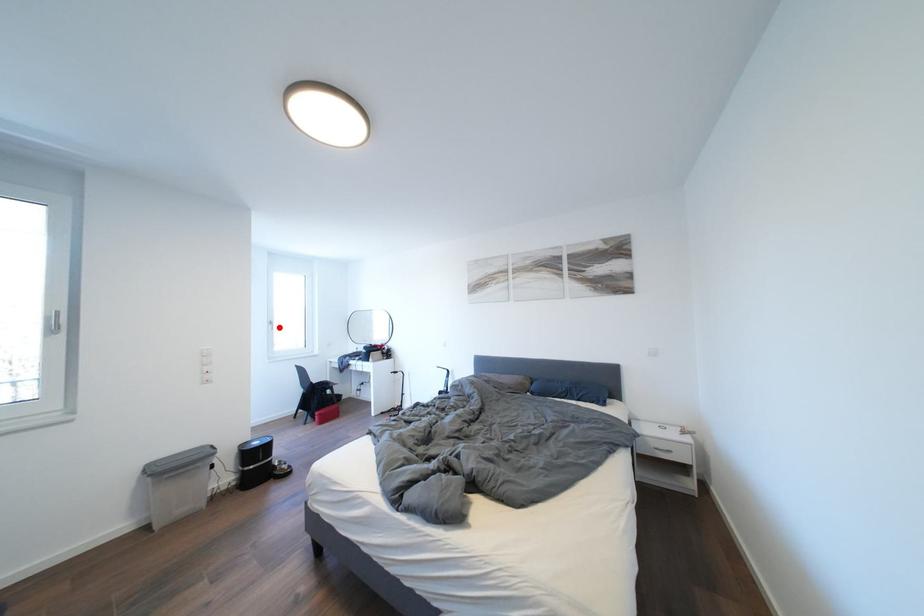
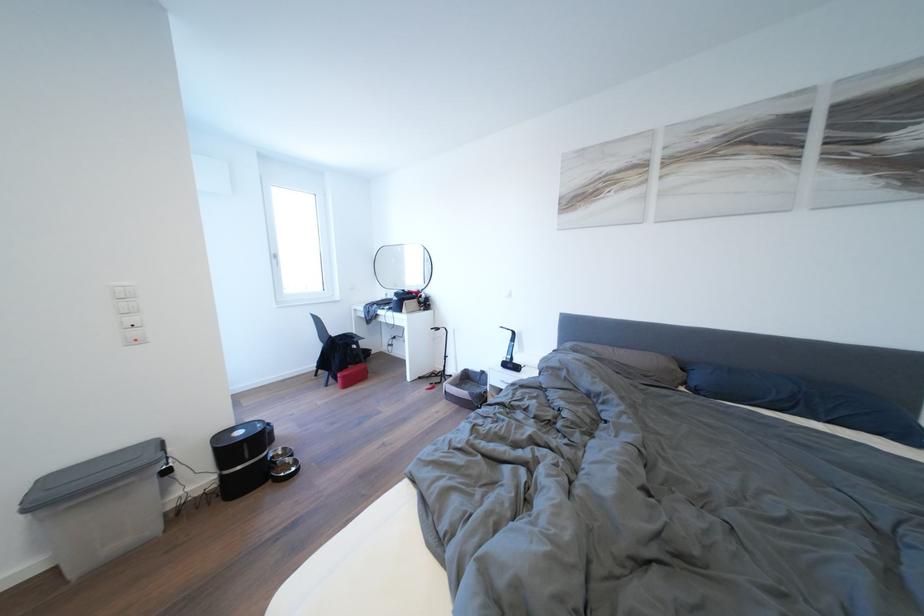
Locate, in the second image, the point that corresponds to the highlighted location in the first image.

(284, 261)